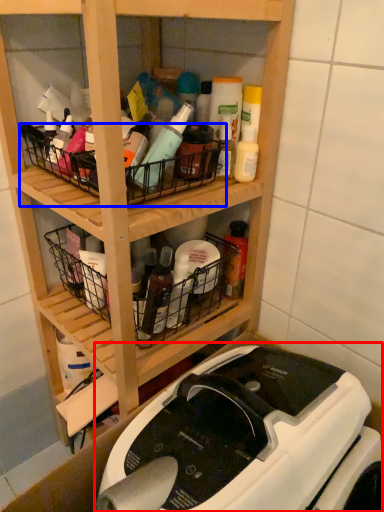
Question: Among these objects, which one is nearest to the camera, sewing machine (highlighted by a red box) or basket (highlighted by a blue box)?

Choices:
 (A) sewing machine
 (B) basket

Answer: (A)